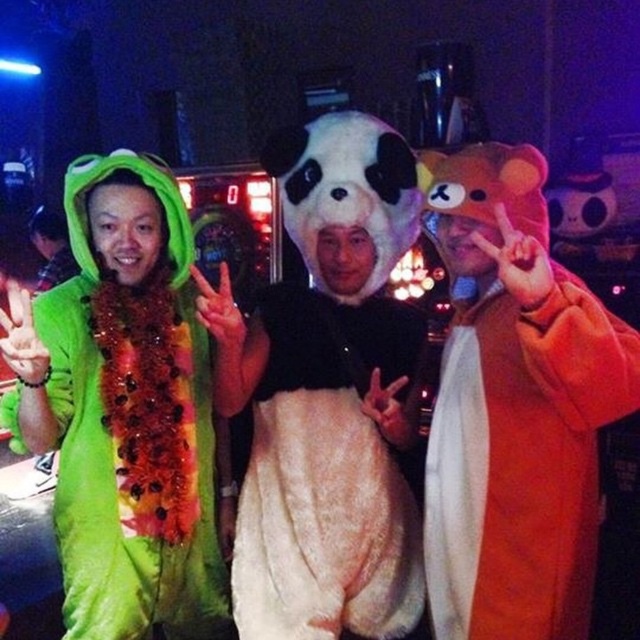
Question: Which point is farther to the camera?

Choices:
 (A) (198, 378)
 (B) (262, 568)
 (C) (468, 548)

Answer: (A)

Question: Which object appears closest to the camera in this image?

Choices:
 (A) green fuzzy frog at left
 (B) fuzzy white dress at center
 (C) orange plush bear at center

Answer: (C)

Question: Can you confirm if orange plush bear at center is thinner than green fuzzy frog at left?

Choices:
 (A) yes
 (B) no

Answer: (A)

Question: Can you confirm if orange plush bear at center is wider than fuzzy white dress at center?

Choices:
 (A) yes
 (B) no

Answer: (B)

Question: Is orange plush bear at center wider than green fuzzy frog at left?

Choices:
 (A) yes
 (B) no

Answer: (B)

Question: Among these objects, which one is farthest from the camera?

Choices:
 (A) orange plush bear at center
 (B) fuzzy white dress at center

Answer: (B)